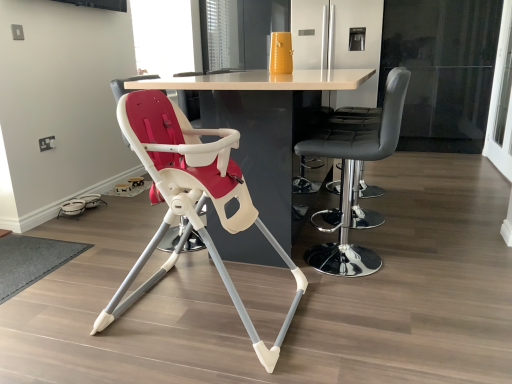
Question: Considering the relative positions of white glossy table at center and transparent glass window screen at upper center in the image provided, is white glossy table at center to the left of transparent glass window screen at upper center from the viewer's perspective?

Choices:
 (A) no
 (B) yes

Answer: (A)

Question: Could you tell me if white glossy table at center is facing transparent glass window screen at upper center?

Choices:
 (A) no
 (B) yes

Answer: (A)

Question: Is white glossy table at center positioned beyond the bounds of transparent glass window screen at upper center?

Choices:
 (A) yes
 (B) no

Answer: (A)

Question: Considering the relative sizes of white glossy table at center and transparent glass window screen at upper center in the image provided, is white glossy table at center smaller than transparent glass window screen at upper center?

Choices:
 (A) yes
 (B) no

Answer: (B)

Question: Are white glossy table at center and transparent glass window screen at upper center beside each other?

Choices:
 (A) no
 (B) yes

Answer: (A)

Question: Does white glossy table at center have a greater height compared to transparent glass window screen at upper center?

Choices:
 (A) yes
 (B) no

Answer: (A)

Question: Does transparent glass window screen at upper center touch transparent glass screen door at right, which appears as the 1th screen door when viewed from the right?

Choices:
 (A) yes
 (B) no

Answer: (B)

Question: Can transparent glass screen door at right, which appears as the first screen door when viewed from the front, be found inside transparent glass window screen at upper center?

Choices:
 (A) no
 (B) yes

Answer: (A)

Question: Does transparent glass window screen at upper center have a larger size compared to transparent glass screen door at right, which appears as the 1th screen door when viewed from the right?

Choices:
 (A) yes
 (B) no

Answer: (A)

Question: Is the depth of transparent glass window screen at upper center less than that of transparent glass screen door at right, marked as the second screen door in a back-to-front arrangement?

Choices:
 (A) yes
 (B) no

Answer: (B)

Question: From the image's perspective, is transparent glass window screen at upper center over transparent glass screen door at right, which appears as the first screen door when viewed from the front?

Choices:
 (A) yes
 (B) no

Answer: (A)

Question: Can you confirm if transparent glass window screen at upper center is positioned to the left of transparent glass screen door at right, marked as the second screen door in a back-to-front arrangement?

Choices:
 (A) yes
 (B) no

Answer: (A)

Question: Could you tell me if matte white highchair at center, which is the 1th chair in left-to-right order, is turned towards transparent glass screen door at right, which appears as the first screen door when viewed from the front?

Choices:
 (A) no
 (B) yes

Answer: (A)